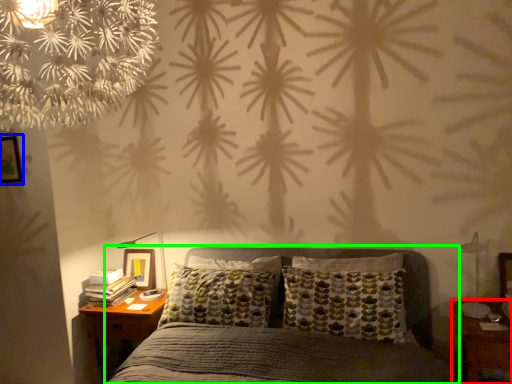
Question: Which object is positioned farthest from nightstand (highlighted by a red box)? Select from picture frame (highlighted by a blue box) and bed (highlighted by a green box).

Choices:
 (A) picture frame
 (B) bed

Answer: (A)